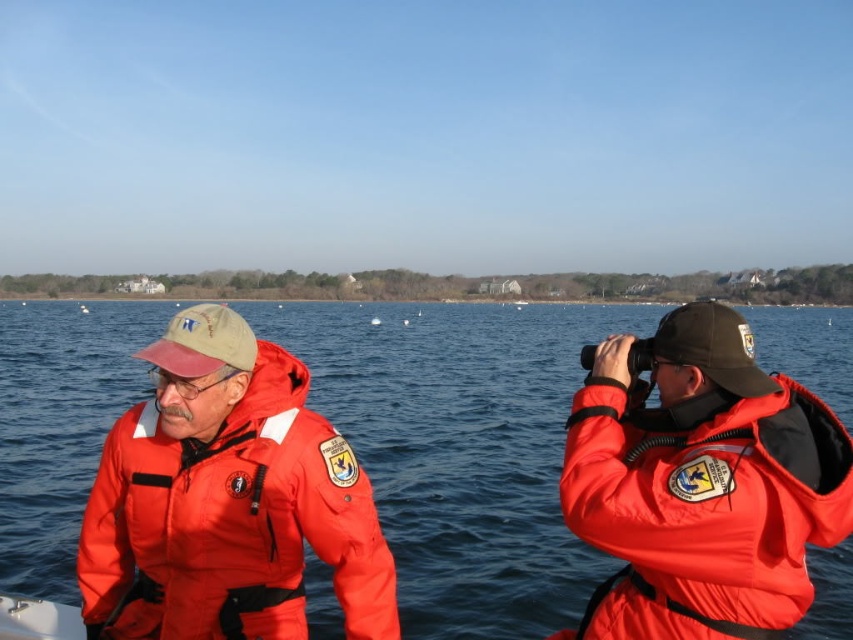
You are a safety inspector on the boat and need to ensure that the two people are visible from the shore. Since both are wearing the same color life jackets, which of the two life jackets, the matte orange life jacket at left or the matte orange life jacket at right, is more likely to be seen by someone on the shore?

The matte orange life jacket at left is more likely to be seen by someone on the shore because the matte orange life jacket at right is behind matte orange life jacket at left, making it partially obscured.

You are a safety inspector checking the boat for compliance. Both the matte orange life jacket at left and the matte orange life jacket at right must meet the minimum height requirement of 30 cm. Based on the scene description, which life jacket might not comply with the regulation?

The matte orange life jacket at right might not comply with the regulation because it is shorter than the matte orange life jacket at left, and if the left one meets the 30 cm requirement, the right one could be below it.